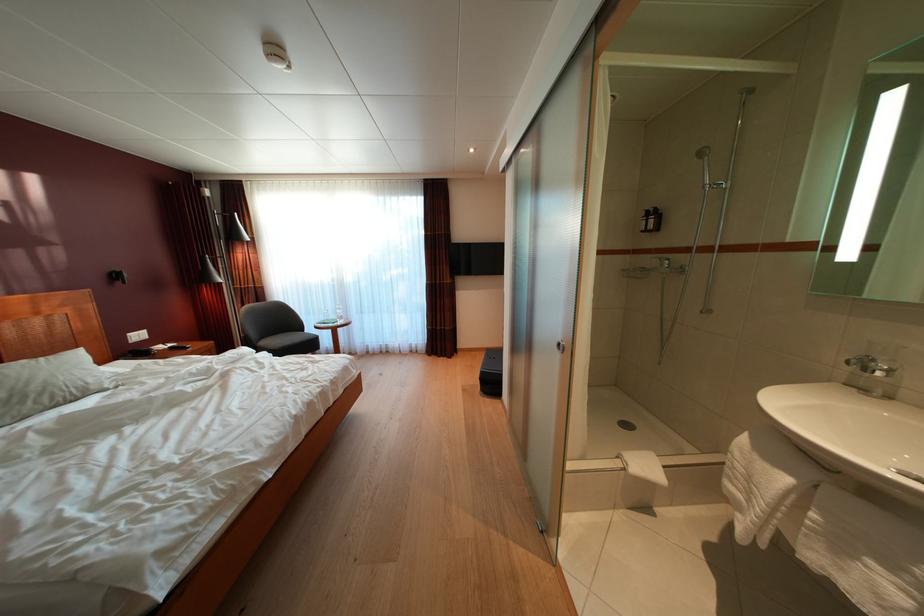
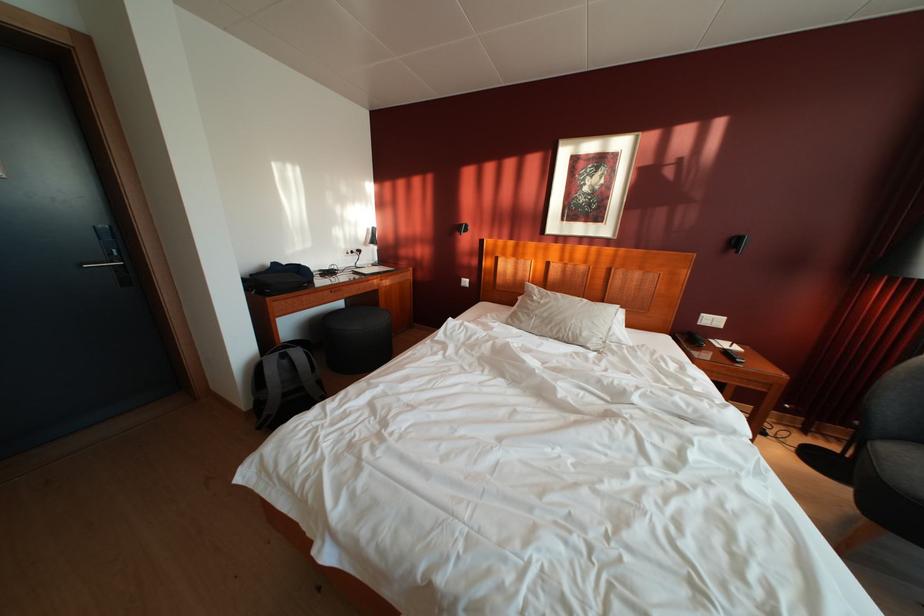
Where in the second image is the point corresponding to point (148, 359) from the first image?

(698, 344)